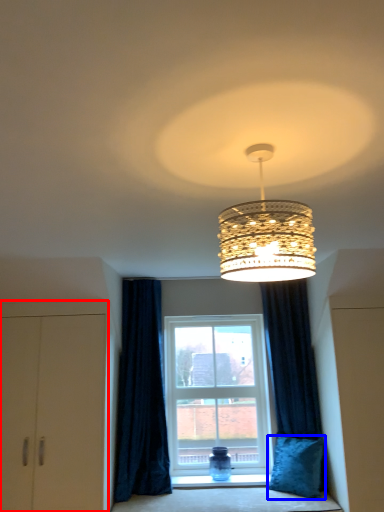
Question: Which of the following is the closest to the observer, dresser (highlighted by a red box) or pillow (highlighted by a blue box)?

Choices:
 (A) dresser
 (B) pillow

Answer: (A)